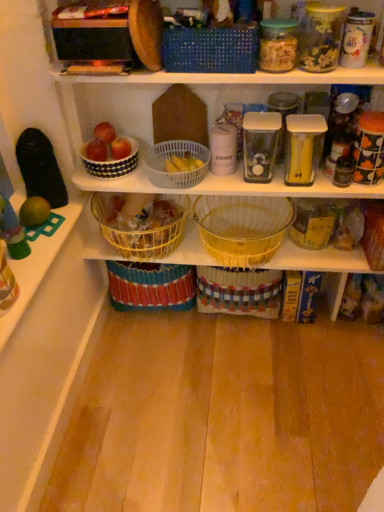
Where is `free region under woven yellow basket at center, which ranks as the 4th basket in left-to-right order (from a real-world perspective)`? The height and width of the screenshot is (512, 384). free region under woven yellow basket at center, which ranks as the 4th basket in left-to-right order (from a real-world perspective) is located at coordinates (258, 232).